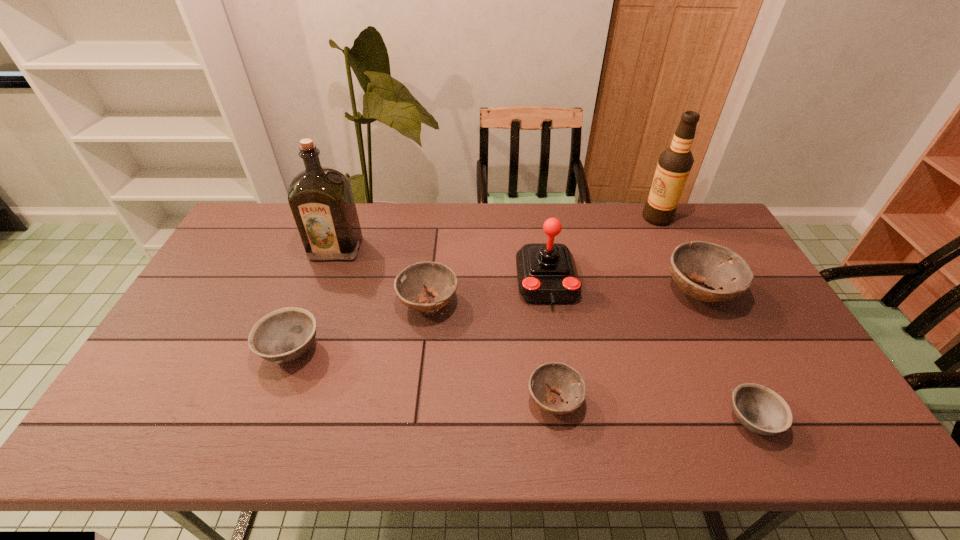
Find the location of a particular element. the farthest object is located at coordinates (674, 165).

Image resolution: width=960 pixels, height=540 pixels. Identify the location of beige alcohol. (674, 165).

You are a GUI agent. You are given a task and a screenshot of the screen. Output one action in this format:
    pyautogui.click(x=<x>, y=<y>)
    Task: Click on the liquor
    Image resolution: width=960 pixels, height=540 pixels.
    Given the screenshot: What is the action you would take?
    pyautogui.click(x=321, y=199)

The width and height of the screenshot is (960, 540). I want to click on joystick, so click(547, 274).

I want to click on the rightmost brown bowl, so click(716, 266).

You are a GUI agent. You are given a task and a screenshot of the screen. Output one action in this format:
    pyautogui.click(x=<x>, y=<y>)
    Task: Click on the fifth shortest object
    The width and height of the screenshot is (960, 540).
    Given the screenshot: What is the action you would take?
    pyautogui.click(x=716, y=266)

You are a GUI agent. You are given a task and a screenshot of the screen. Output one action in this format:
    pyautogui.click(x=<x>, y=<y>)
    Task: Click on the leftmost brown bowl
    
    Given the screenshot: What is the action you would take?
    pyautogui.click(x=438, y=279)

You are a GUI agent. You are given a task and a screenshot of the screen. Output one action in this format:
    pyautogui.click(x=<x>, y=<y>)
    Task: Click on the fourth bowl from right to left
    
    Given the screenshot: What is the action you would take?
    tap(438, 279)

Locate an element on the screen. The height and width of the screenshot is (540, 960). the farther gray bowl is located at coordinates (283, 335).

In order to click on the leftmost bowl in this screenshot , I will do `click(283, 335)`.